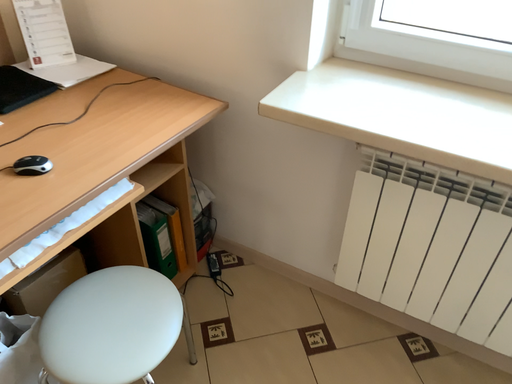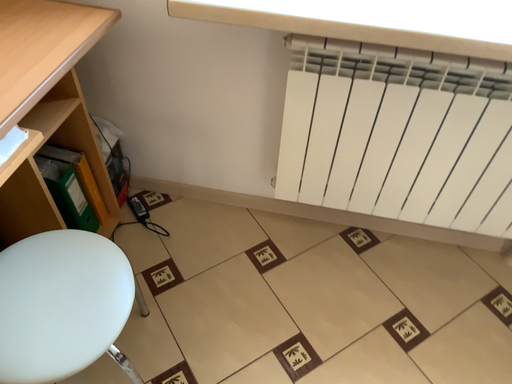
Question: How did the camera likely rotate when shooting the video?

Choices:
 (A) rotated right
 (B) rotated left

Answer: (A)